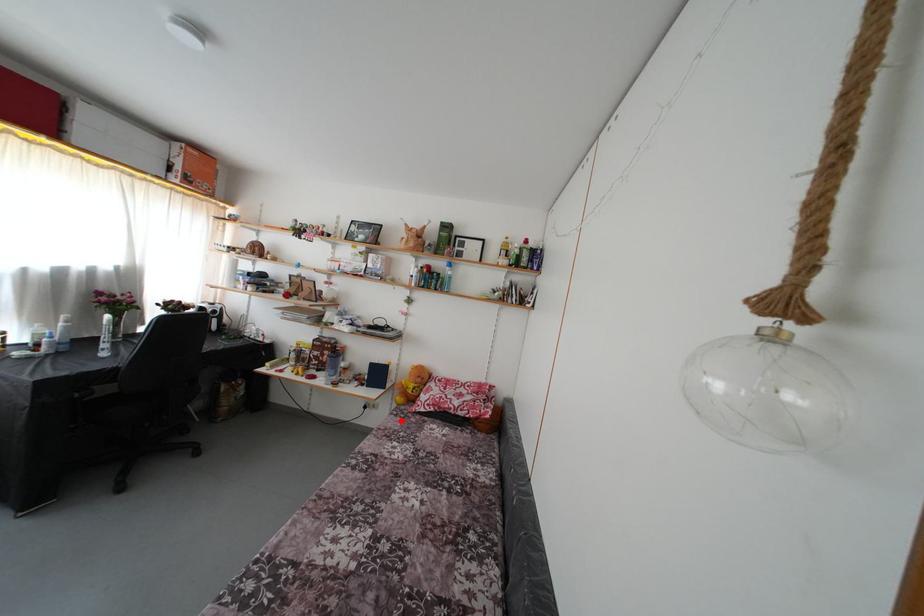
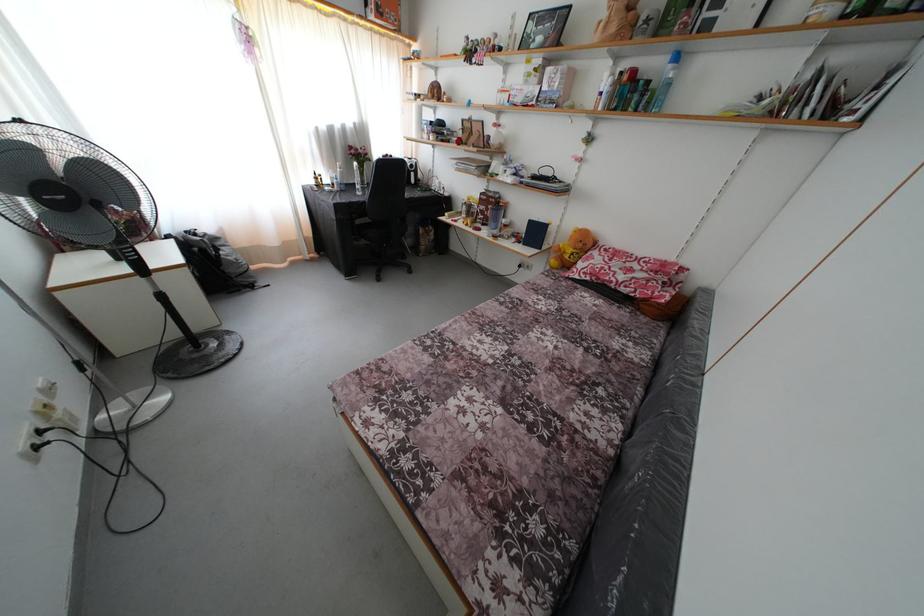
Where in the second image is the point corresponding to the highlighted location from the first image?

(552, 282)